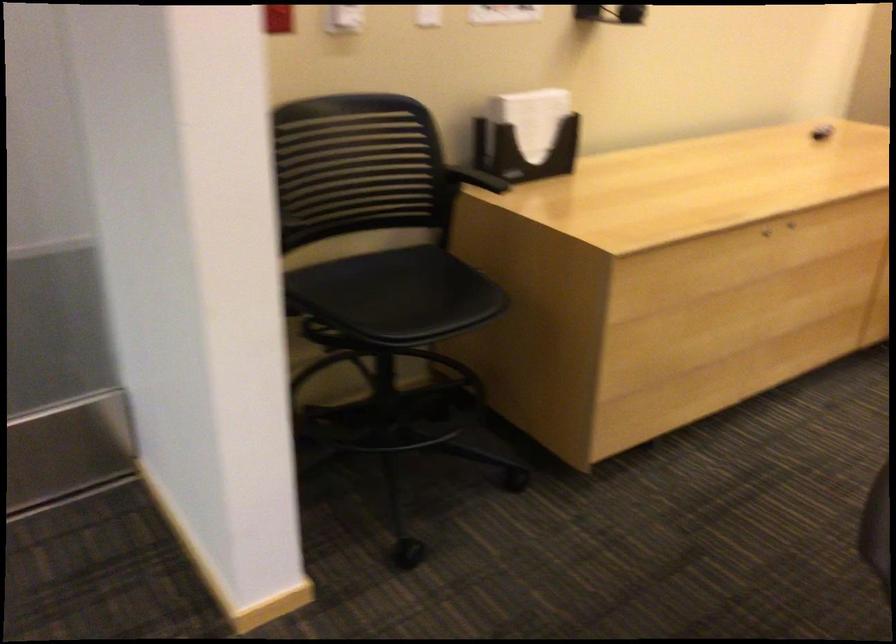
This screenshot has height=644, width=896. I want to click on chair sitting surface, so click(x=394, y=295).